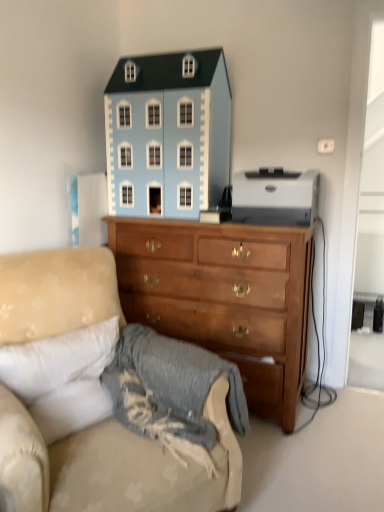
Question: Should I look upward or downward to see white glossy printer at upper right, the first toy in the right-to-left sequence?

Choices:
 (A) up
 (B) down

Answer: (A)

Question: From the image's perspective, is light blue painted wood dollhouse at upper center, marked as the 1th toy in a left-to-right arrangement, on top of beige fabric couch at lower left?

Choices:
 (A) no
 (B) yes

Answer: (B)

Question: Is light blue painted wood dollhouse at upper center, marked as the 1th toy in a left-to-right arrangement, next to beige fabric couch at lower left?

Choices:
 (A) yes
 (B) no

Answer: (B)

Question: Can you confirm if light blue painted wood dollhouse at upper center, marked as the 1th toy in a left-to-right arrangement, is thinner than beige fabric couch at lower left?

Choices:
 (A) no
 (B) yes

Answer: (B)

Question: Can you confirm if light blue painted wood dollhouse at upper center, marked as the 1th toy in a left-to-right arrangement, is smaller than beige fabric couch at lower left?

Choices:
 (A) no
 (B) yes

Answer: (B)

Question: Does light blue painted wood dollhouse at upper center, marked as the 1th toy in a left-to-right arrangement, turn towards beige fabric couch at lower left?

Choices:
 (A) no
 (B) yes

Answer: (A)

Question: From the image's perspective, would you say light blue painted wood dollhouse at upper center, which is the 2th toy in right-to-left order, is shown under beige fabric couch at lower left?

Choices:
 (A) yes
 (B) no

Answer: (B)

Question: Considering the relative positions of white glossy printer at upper right, the first toy in the right-to-left sequence, and wooden chest of drawers at center in the image provided, is white glossy printer at upper right, the first toy in the right-to-left sequence, behind wooden chest of drawers at center?

Choices:
 (A) no
 (B) yes

Answer: (B)

Question: Can you confirm if white glossy printer at upper right, which is counted as the 2th toy, starting from the left, is taller than wooden chest of drawers at center?

Choices:
 (A) no
 (B) yes

Answer: (A)

Question: From the image's perspective, is white glossy printer at upper right, which is counted as the 2th toy, starting from the left, under wooden chest of drawers at center?

Choices:
 (A) yes
 (B) no

Answer: (B)

Question: Does white glossy printer at upper right, which is counted as the 2th toy, starting from the left, have a lesser width compared to wooden chest of drawers at center?

Choices:
 (A) yes
 (B) no

Answer: (A)

Question: Considering the relative sizes of white glossy printer at upper right, which is counted as the 2th toy, starting from the left, and wooden chest of drawers at center in the image provided, is white glossy printer at upper right, which is counted as the 2th toy, starting from the left, smaller than wooden chest of drawers at center?

Choices:
 (A) no
 (B) yes

Answer: (B)

Question: Does white glossy printer at upper right, the first toy in the right-to-left sequence, have a lesser height compared to wooden chest of drawers at center?

Choices:
 (A) yes
 (B) no

Answer: (A)

Question: Can you confirm if white glossy printer at upper right, which is counted as the 2th toy, starting from the left, is taller than light blue painted wood dollhouse at upper center, which is the 2th toy in right-to-left order?

Choices:
 (A) yes
 (B) no

Answer: (B)